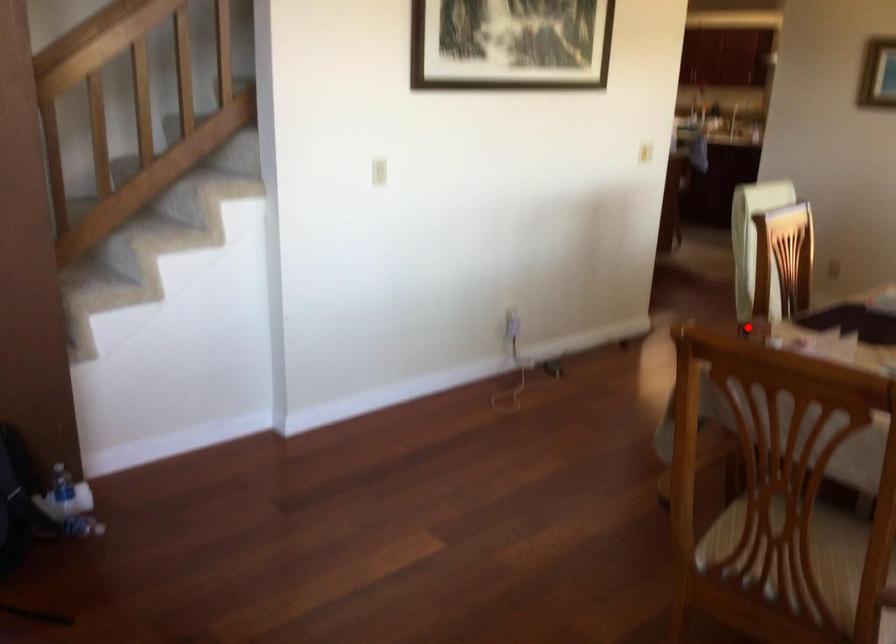
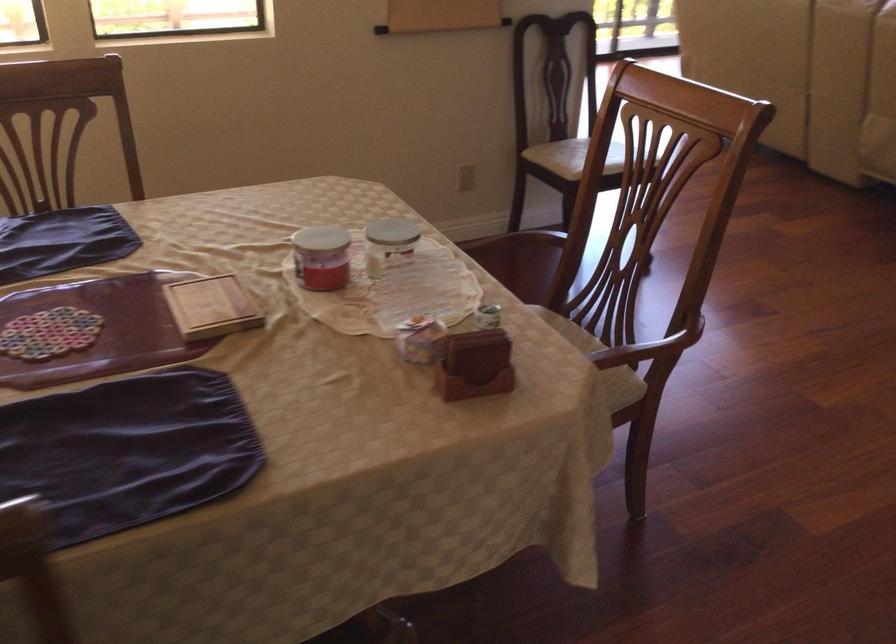
Find the pixel in the second image that matches the highlighted location in the first image.

(475, 365)